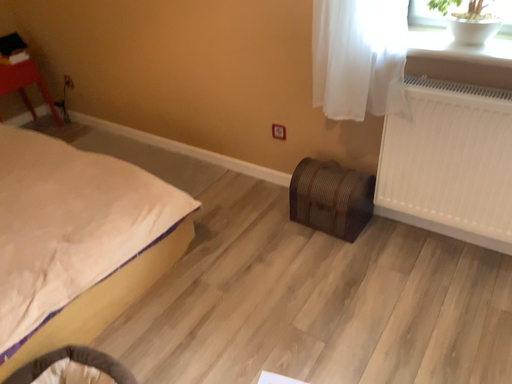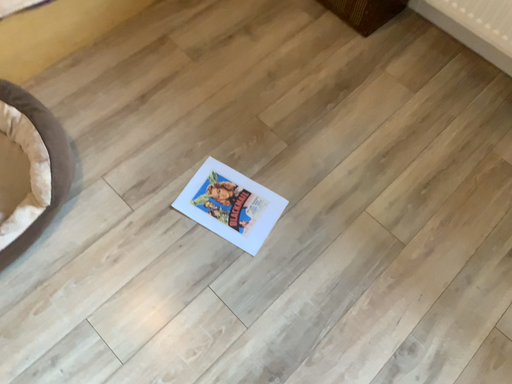
Question: Which way did the camera rotate in the video?

Choices:
 (A) rotated upward
 (B) rotated downward

Answer: (B)